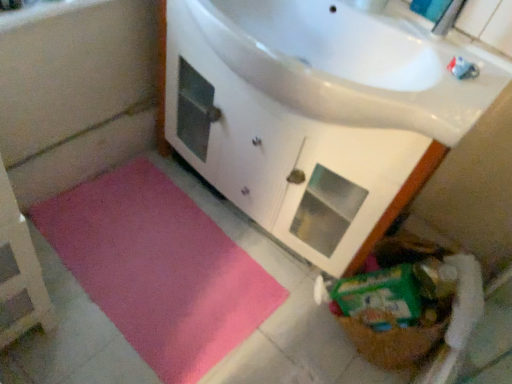
This screenshot has height=384, width=512. Describe the element at coordinates (76, 95) in the screenshot. I see `pink fabric bath mat at lower left` at that location.

The height and width of the screenshot is (384, 512). Describe the element at coordinates (396, 311) in the screenshot. I see `brown woven basket at lower right` at that location.

Measure the distance between point (313,239) and camera.

4.84 feet.

The width and height of the screenshot is (512, 384). What are the coordinates of `white glossy cabinet at upper center` in the screenshot? It's located at (287, 156).

Locate an element on the screen. pink plush bath mat at lower left is located at coordinates tap(159, 269).

Identify the location of pink fabric bath mat at lower left. (76, 95).

Between brown woven basket at lower right and pink fabric bath mat at lower left, which one appears on the left side from the viewer's perspective?

Positioned to the left is pink fabric bath mat at lower left.

Is brown woven basket at lower right positioned with its back to pink fabric bath mat at lower left?

brown woven basket at lower right does not have its back to pink fabric bath mat at lower left.

From the image's perspective, between brown woven basket at lower right and pink fabric bath mat at lower left, who is located below?

From the image's view, brown woven basket at lower right is below.

Find the location of a particular element. The image size is (512, 384). bath behind the brown woven basket at lower right is located at coordinates (76, 95).

Which is closer, (267,281) or (408,283)?

Point (267,281).

Between pink plush bath mat at lower left and brown woven basket at lower right, which one has more height?

Standing taller between the two is brown woven basket at lower right.

Based on the photo, between pink plush bath mat at lower left and brown woven basket at lower right, which one has larger width?

pink plush bath mat at lower left.

From the picture: From their relative heights in the image, would you say brown woven basket at lower right is taller or shorter than pink plush bath mat at lower left?

brown woven basket at lower right is taller than pink plush bath mat at lower left.

Can you tell me how much brown woven basket at lower right and pink plush bath mat at lower left differ in facing direction?

There is a 5.72-degree angle between the facing directions of brown woven basket at lower right and pink plush bath mat at lower left.

Would you say brown woven basket at lower right is inside or outside pink plush bath mat at lower left?

The correct answer is: outside.

Looking at this image, which is behind, brown woven basket at lower right or pink plush bath mat at lower left?

Positioned behind is pink plush bath mat at lower left.

At what (x,y) coordinates should I click in order to perform the action: click on faucet above the pink plush bath mat at lower left (from the image's perspective). Please return your answer as a coordinate pair (x, y). The image size is (512, 384). Looking at the image, I should click on (447, 18).

Consider the image. From the image's perspective, between pink plush bath mat at lower left and white glossy faucet at upper center, which one is located above?

From the image's view, white glossy faucet at upper center is above.

From the picture: Is pink plush bath mat at lower left not close to white glossy faucet at upper center?

Yes, pink plush bath mat at lower left and white glossy faucet at upper center are located far from each other.

Can you confirm if pink plush bath mat at lower left is positioned to the left of white glossy faucet at upper center?

Yes.

Which object is further away from the camera taking this photo, white glossy cabinet at upper center or pink fabric bath mat at lower left?

pink fabric bath mat at lower left is behind.

Which object is thinner, white glossy cabinet at upper center or pink fabric bath mat at lower left?

pink fabric bath mat at lower left is thinner.

From the image's perspective, between white glossy cabinet at upper center and pink fabric bath mat at lower left, which one is located above?

white glossy cabinet at upper center appears higher in the image.

From the image's perspective, which one is positioned lower, white glossy cabinet at upper center or white glossy faucet at upper center?

white glossy cabinet at upper center.

Is white glossy cabinet at upper center inside the boundaries of white glossy faucet at upper center, or outside?

white glossy cabinet at upper center is located beyond the bounds of white glossy faucet at upper center.

Considering the sizes of objects white glossy cabinet at upper center and white glossy faucet at upper center in the image provided, who is smaller, white glossy cabinet at upper center or white glossy faucet at upper center?

white glossy faucet at upper center is smaller.

The width and height of the screenshot is (512, 384). Find the location of `bathroom cabinet that appears in front of the white glossy faucet at upper center`. bathroom cabinet that appears in front of the white glossy faucet at upper center is located at coordinates (287, 156).

Is white glossy faucet at upper center positioned far away from brown woven basket at lower right?

white glossy faucet at upper center is actually quite close to brown woven basket at lower right.

Between point (458, 1) and point (415, 315), which one is positioned in front?

Point (458, 1)

Is white glossy faucet at upper center wider than brown woven basket at lower right?

In fact, white glossy faucet at upper center might be narrower than brown woven basket at lower right.

The width and height of the screenshot is (512, 384). Find the location of `basket in front of the pink fabric bath mat at lower left`. basket in front of the pink fabric bath mat at lower left is located at coordinates (396, 311).

Image resolution: width=512 pixels, height=384 pixels. I want to click on bath mat below the brown woven basket at lower right (from a real-world perspective), so click(x=159, y=269).

Looking at the image, which one is located closer to pink plush bath mat at lower left, pink fabric bath mat at lower left or white glossy cabinet at upper center?

Among the two, white glossy cabinet at upper center is located nearer to pink plush bath mat at lower left.

When comparing their distances from pink fabric bath mat at lower left, does white glossy faucet at upper center or white glossy cabinet at upper center seem further?

white glossy faucet at upper center lies further to pink fabric bath mat at lower left than the other object.

From the image, which object appears to be nearer to pink plush bath mat at lower left, white glossy cabinet at upper center or white glossy faucet at upper center?

white glossy cabinet at upper center lies closer to pink plush bath mat at lower left than the other object.

Estimate the real-world distances between objects in this image. Which object is closer to brown woven basket at lower right, white glossy faucet at upper center or white glossy cabinet at upper center?

Based on the image, white glossy cabinet at upper center appears to be nearer to brown woven basket at lower right.

Which object lies nearer to the anchor point brown woven basket at lower right, pink plush bath mat at lower left or white glossy cabinet at upper center?

The object closer to brown woven basket at lower right is white glossy cabinet at upper center.

Based on their spatial positions, is white glossy faucet at upper center or pink fabric bath mat at lower left closer to brown woven basket at lower right?

white glossy faucet at upper center is closer to brown woven basket at lower right.

Considering their positions, is brown woven basket at lower right positioned further to white glossy faucet at upper center than pink fabric bath mat at lower left?

pink fabric bath mat at lower left.

In the scene shown: Based on their spatial positions, is brown woven basket at lower right or white glossy faucet at upper center further from pink plush bath mat at lower left?

white glossy faucet at upper center is positioned further to the anchor pink plush bath mat at lower left.

Image resolution: width=512 pixels, height=384 pixels. I want to click on bathroom cabinet between pink fabric bath mat at lower left and white glossy faucet at upper center in the horizontal direction, so click(287, 156).

Locate an element on the screen. bathroom cabinet situated between pink fabric bath mat at lower left and brown woven basket at lower right from left to right is located at coordinates (287, 156).

Locate an element on the screen. The width and height of the screenshot is (512, 384). basket between pink fabric bath mat at lower left and white glossy faucet at upper center from left to right is located at coordinates (396, 311).

Identify the location of bathroom cabinet between pink plush bath mat at lower left and white glossy faucet at upper center in the horizontal direction. (287, 156).